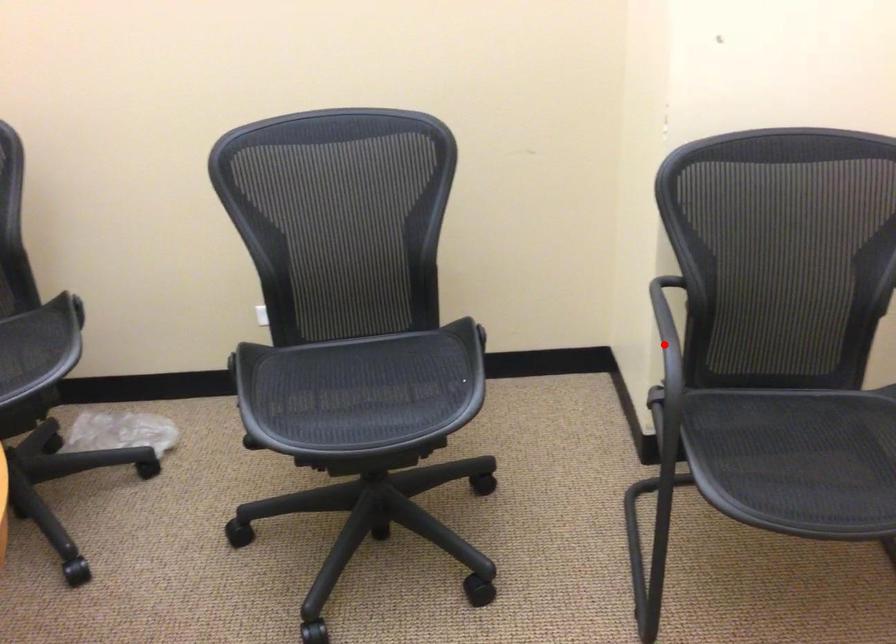
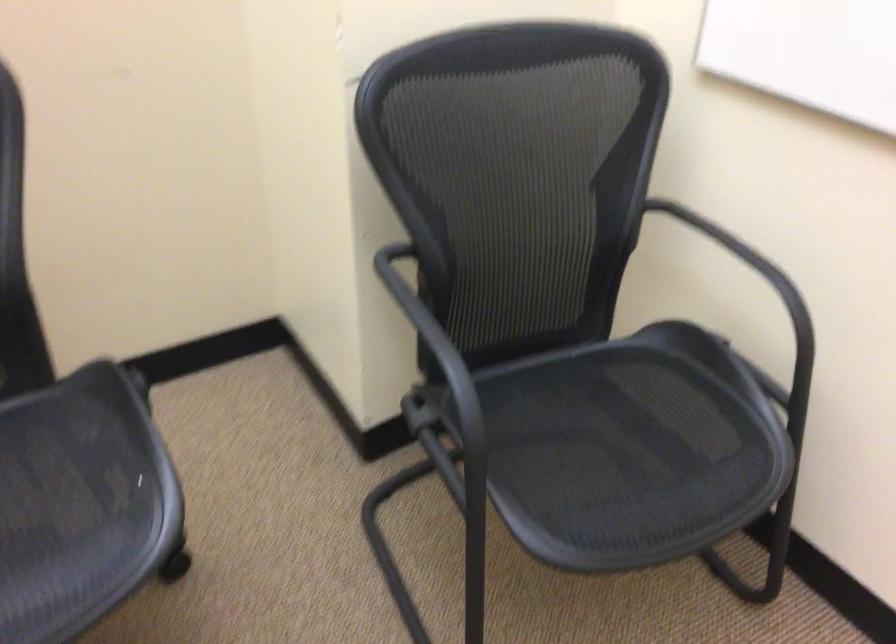
Find the pixel in the second image that matches the highlighted location in the first image.

(438, 357)